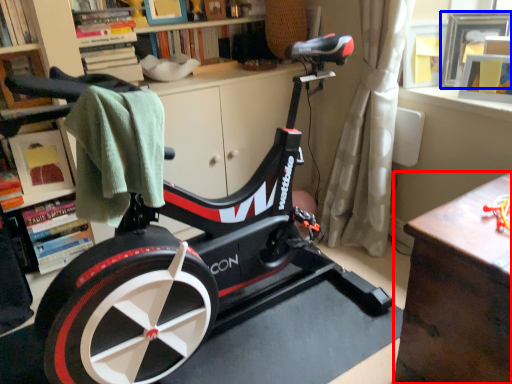
Question: Which object appears closest to the camera in this image, table (highlighted by a red box) or picture frame (highlighted by a blue box)?

Choices:
 (A) table
 (B) picture frame

Answer: (A)